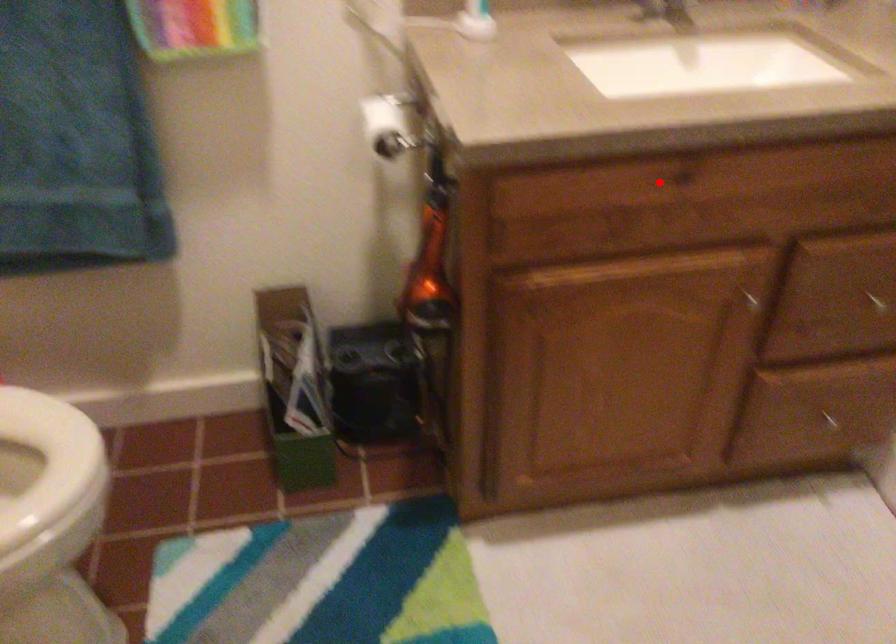
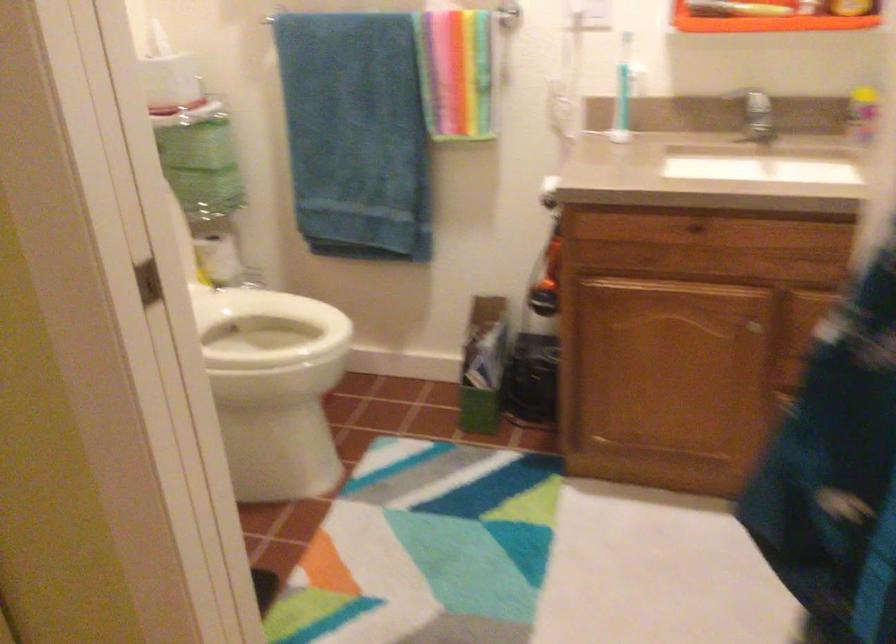
Question: I am providing you with two images of the same scene from different viewpoints. Given a red point in image1, look at the same physical point in image2. Is it:

Choices:
 (A) Closer to the viewpoint
 (B) Farther from the viewpoint

Answer: (B)